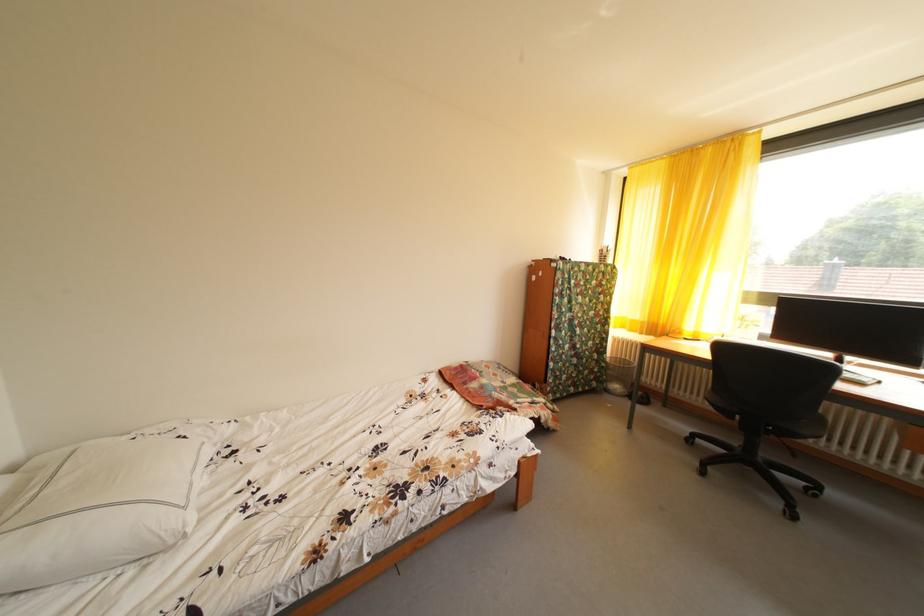
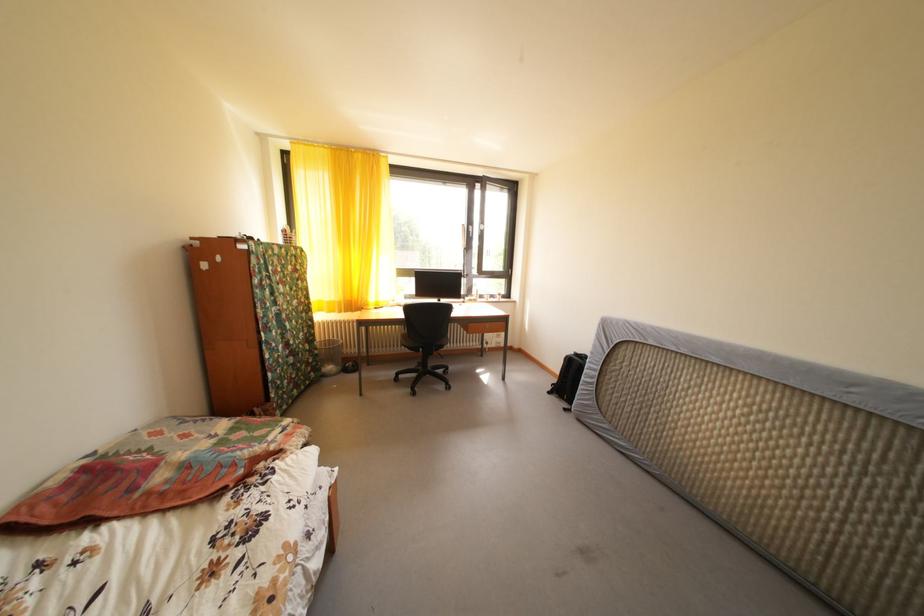
Where in the second image is the point corresponding to (x=606, y=367) from the first image?

(320, 357)